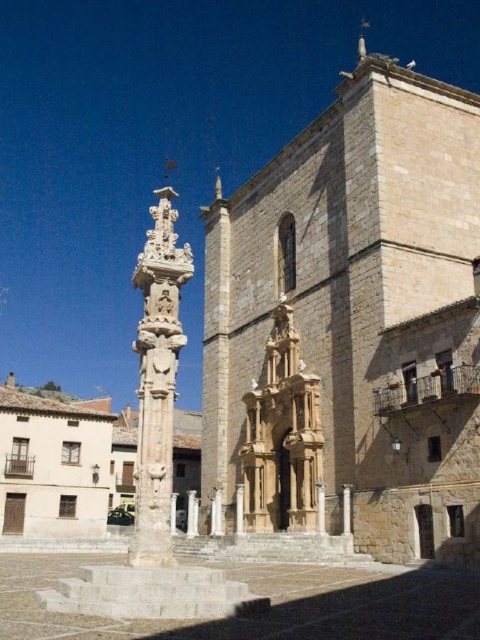
Is point (4, 520) closer to viewer compared to point (164, 424)?

That is False.

Can you confirm if light brown stone church at center is thinner than white stone column at center?

No.

Who is more distant from viewer, (23, 477) or (149, 284)?

The point (23, 477) is behind.

Find the location of a particular element. light brown stone church at center is located at coordinates (52, 465).

Is beige stone church at center positioned before white stone column at center?

No, it is behind white stone column at center.

Between beige stone church at center and white stone column at center, which one appears on the left side from the viewer's perspective?

Positioned to the left is white stone column at center.

Between point (458, 99) and point (178, 296), which one is positioned in front?

Positioned in front is point (178, 296).

This screenshot has width=480, height=640. What are the coordinates of `beige stone church at center` in the screenshot? It's located at (361, 307).

Between point (256, 330) and point (19, 451), which one is positioned in front?

Point (256, 330)

Does beige stone church at center come behind light brown stone church at center?

No, beige stone church at center is closer to the viewer.

What do you see at coordinates (361, 307) in the screenshot? I see `beige stone church at center` at bounding box center [361, 307].

Find the location of a particular element. Image resolution: width=480 pixels, height=640 pixels. beige stone church at center is located at coordinates (361, 307).